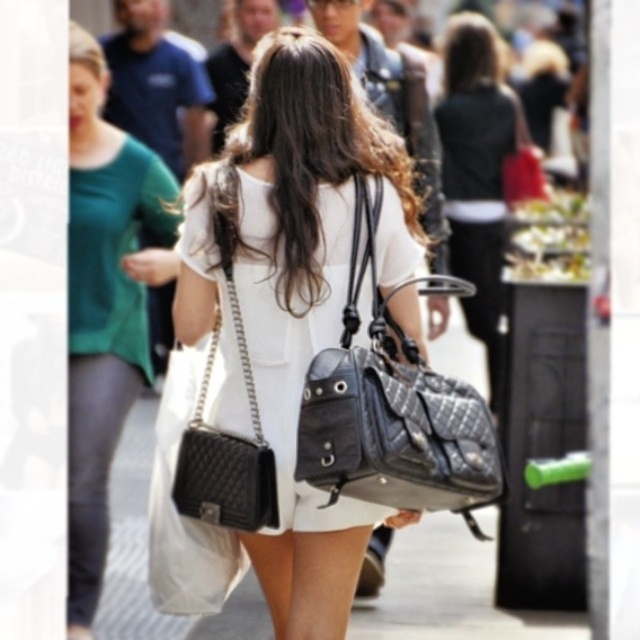
Question: Considering the real-world distances, which object is farthest from the matte black handbag at center?

Choices:
 (A) quilted leather shoulder bag at center
 (B) white quilted leather handbag at center

Answer: (A)

Question: Which of the following is the closest to the observer?

Choices:
 (A) (323, 468)
 (B) (378, 576)
 (C) (493, 141)
 (D) (349, 540)

Answer: (A)

Question: Is black quilted leather handbag at center to the right of matte black handbag at upper right from the viewer's perspective?

Choices:
 (A) yes
 (B) no

Answer: (B)

Question: Does quilted leather shoulder bag at center have a smaller size compared to matte black handbag at upper right?

Choices:
 (A) no
 (B) yes

Answer: (B)

Question: Among these points, which one is farthest from the camera?

Choices:
 (A) (342, 170)
 (B) (384, 492)
 (C) (445, 32)
 (D) (365, 563)

Answer: (C)

Question: Is matte black handbag at upper right smaller than leather sandal at lower center?

Choices:
 (A) yes
 (B) no

Answer: (B)